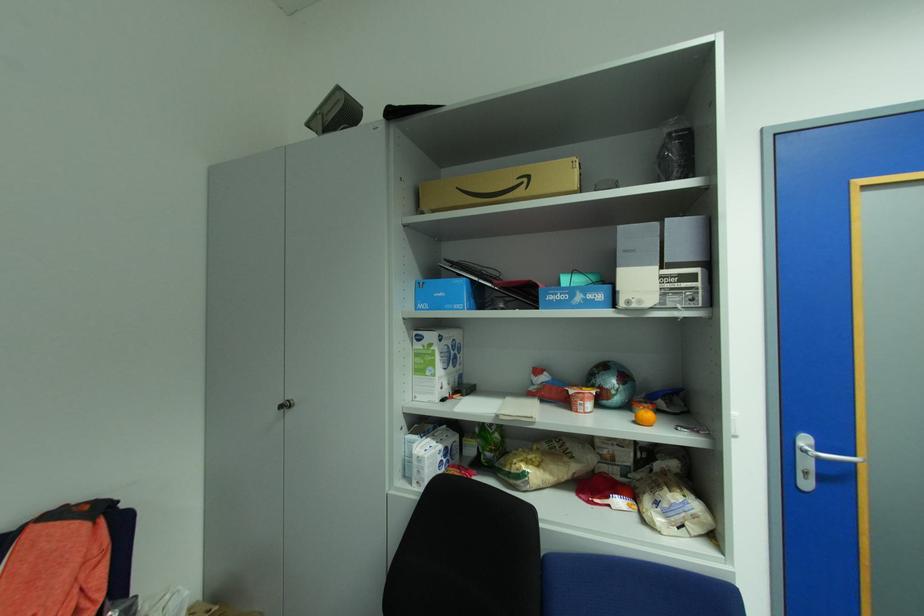
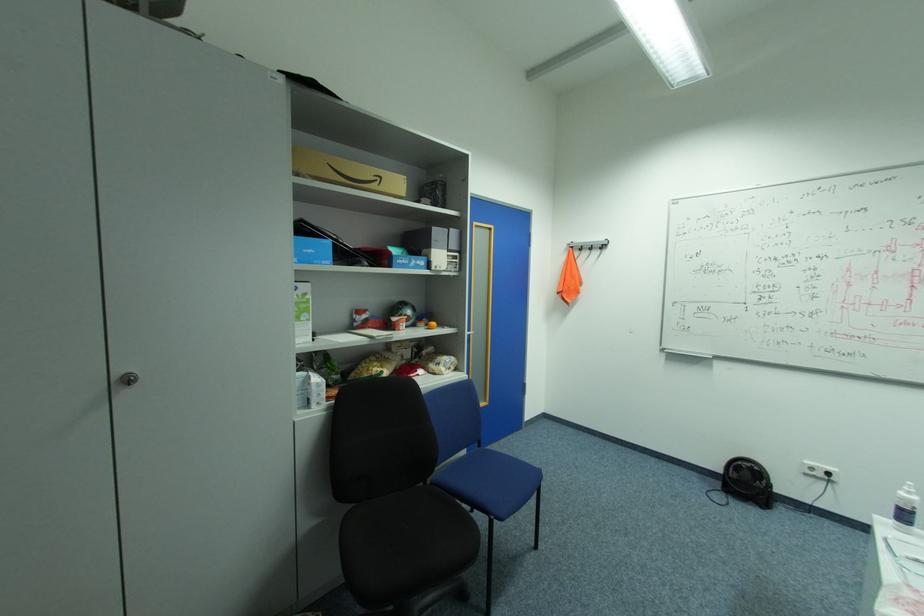
The point at (x=600, y=386) is marked in the first image. Where is the corresponding point in the second image?

(407, 315)